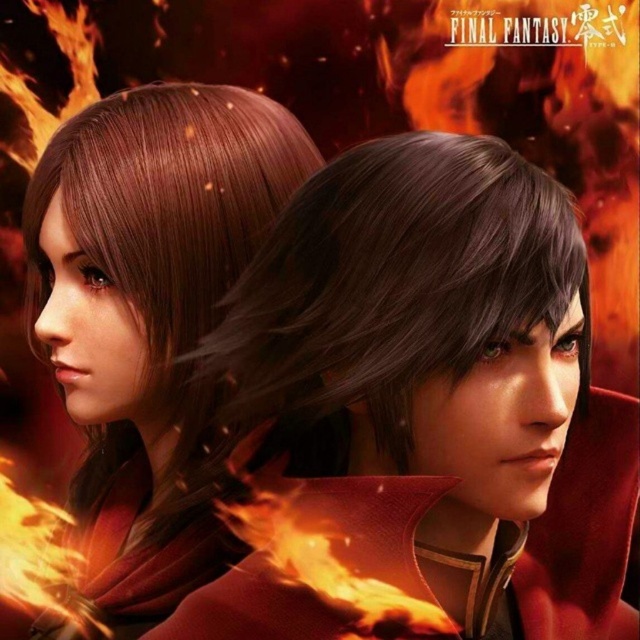
Question: Which of the following is the farthest from the observer?

Choices:
 (A) (464, 150)
 (B) (216, 244)

Answer: (B)

Question: Does shiny brown hair at upper left appear under matte brown hair at left?

Choices:
 (A) yes
 (B) no

Answer: (A)

Question: Does shiny brown hair at upper left appear under matte brown hair at left?

Choices:
 (A) yes
 (B) no

Answer: (A)

Question: Is shiny brown hair at upper left further to the viewer compared to matte brown hair at left?

Choices:
 (A) yes
 (B) no

Answer: (B)